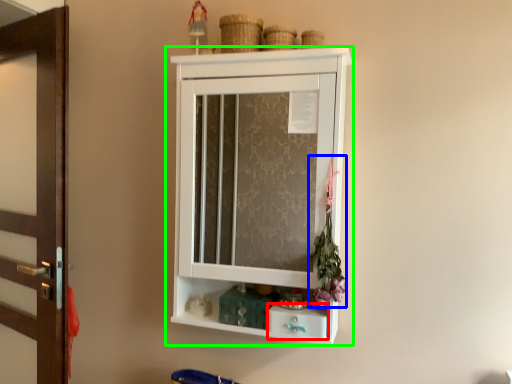
Question: Estimate the real-world distances between objects in this image. Which object is farther from drawer (highlighted by a red box), flower (highlighted by a blue box) or cupboard (highlighted by a green box)?

Choices:
 (A) flower
 (B) cupboard

Answer: (B)